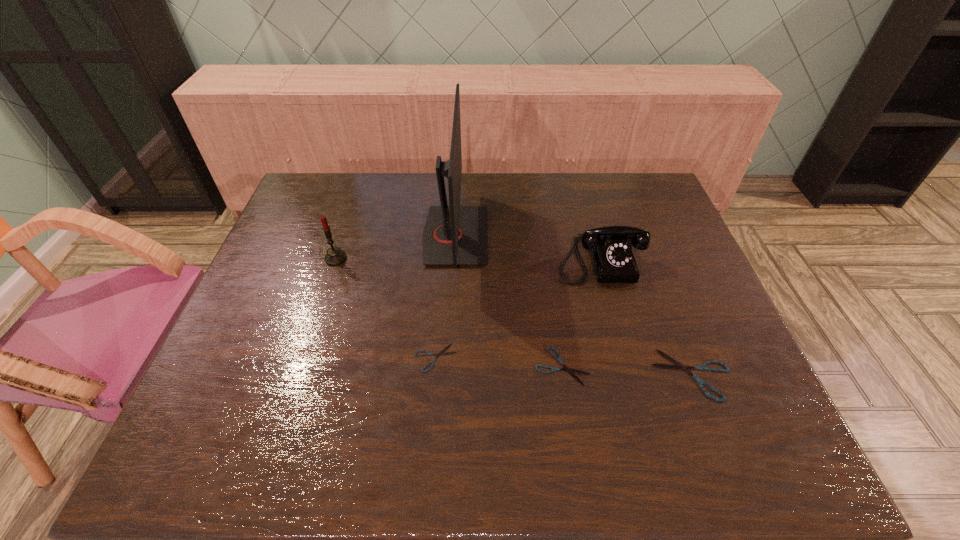
The shearss are evenly distributed in the image. To maintain this, where would you place another shears on the left? Please point to a free space. Please provide its 2D coordinates. Your answer should be formatted as a tuple, i.e. [(x, y)], where the tuple contains the x and y coordinates of a point satisfying the conditions above.

[(312, 350)]